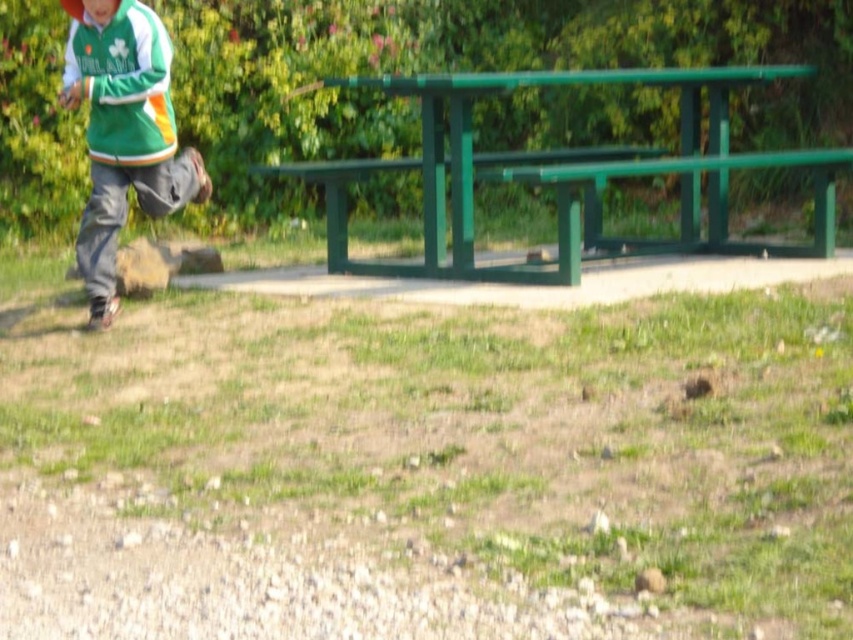
You are a photographer trying to capture the person in the green fleece jacket at left and the green matte baseball cap at upper left. Which object should you focus on first if you want to photograph the one that is closer to the camera?

The green fleece jacket at left is positioned under the green matte baseball cap at upper left, so it is closer to the camera. Focus on the green fleece jacket at left first.

You are a photographer setting up a tripod to capture the scene. The tripod requires a flat surface that is wider than the green matte baseball cap at upper left. Can the green painted wood bench at center provide a suitable surface for the tripod?

The green painted wood bench at center might be wider than the green matte baseball cap at upper left, so it could potentially provide a suitable surface for the tripod if its width meets the requirement.

You are a photographer standing in the park and want to take a photo of the green painted wood bench at center and the green matte baseball cap at upper left. Which object should you focus on first if you want to capture both in sharp focus?

The green painted wood bench at center is closer to the viewer than the green matte baseball cap at upper left, so you should focus on the green painted wood bench at center first to ensure both are in sharp focus.